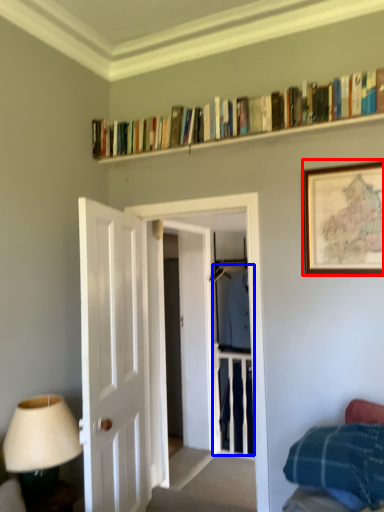
Question: Which of the following is the farthest to the observer, picture frame (highlighted by a red box) or clothing (highlighted by a blue box)?

Choices:
 (A) picture frame
 (B) clothing

Answer: (B)